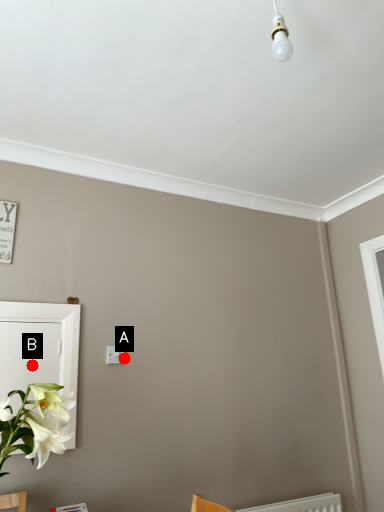
Question: Two points are circled on the image, labeled by A and B beside each circle. Which point is farther to the camera?

Choices:
 (A) A is further
 (B) B is further

Answer: (A)